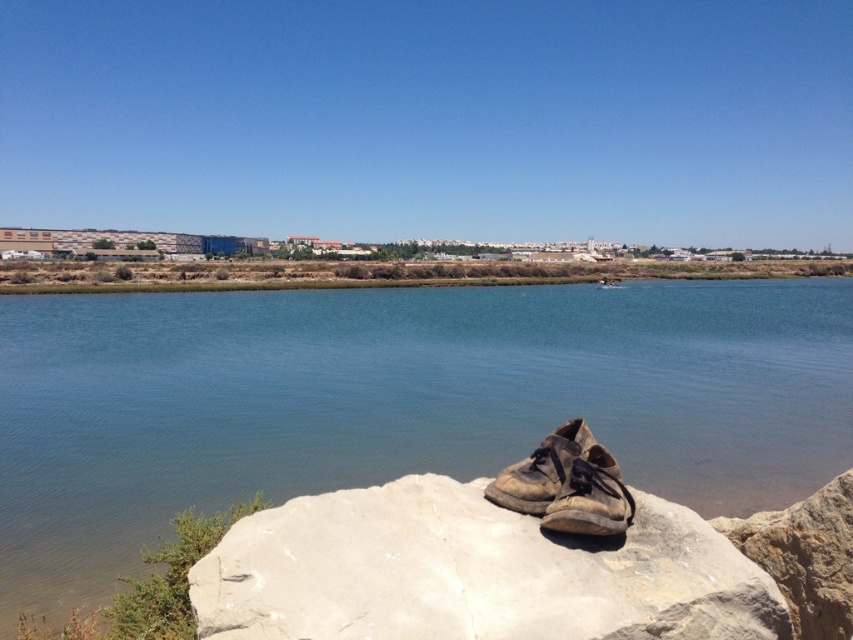
Which of these two, blue water at center or worn leather shoe at center, stands taller?

Standing taller between the two is blue water at center.

Does blue water at center have a lesser height compared to worn leather shoe at center?

No, blue water at center is not shorter than worn leather shoe at center.

Is point (322, 474) behind point (590, 484)?

Yes, it is behind point (590, 484).

The height and width of the screenshot is (640, 853). What are the coordinates of `blue water at center` in the screenshot? It's located at (393, 401).

Can you confirm if blue water at center is positioned to the left of smooth gray rock at center?

Yes, blue water at center is to the left of smooth gray rock at center.

Which of these two, blue water at center or smooth gray rock at center, stands shorter?

smooth gray rock at center is shorter.

Who is more forward, (137, 388) or (480, 518)?

Point (480, 518) is more forward.

Where is `blue water at center`? Image resolution: width=853 pixels, height=640 pixels. blue water at center is located at coordinates (393, 401).

Which is above, smooth gray rock at center or worn leather shoe at center?

worn leather shoe at center is higher up.

Is point (735, 627) positioned before point (584, 502)?

Yes.

Is point (471, 493) closer to camera compared to point (589, 520)?

No, (471, 493) is behind (589, 520).

This screenshot has width=853, height=640. Find the location of `smooth gray rock at center`. smooth gray rock at center is located at coordinates (473, 572).